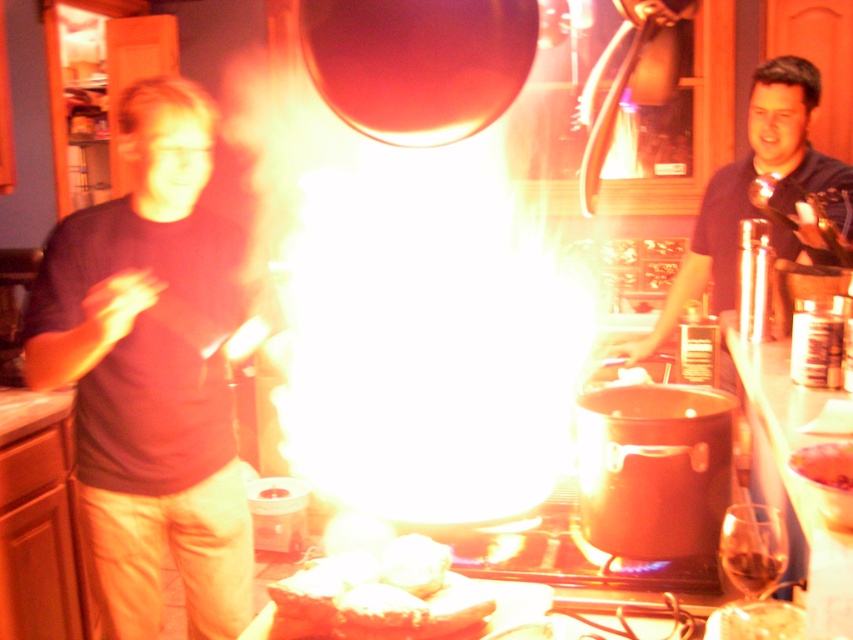
You are a chef in the kitchen and notice two items in the scene. One is the black matte shirt at right and the other is the white fluffy bread at center. Which item is positioned more to the east side of the kitchen?

The black matte shirt at right is to the right of the white fluffy bread at center, so it is positioned more to the east side of the kitchen.

Based on the coordinates provided, which object is located at the point with coordinates (x=155, y=364)?

The point at coordinates (x=155, y=364) marks the matte black shirt at left.